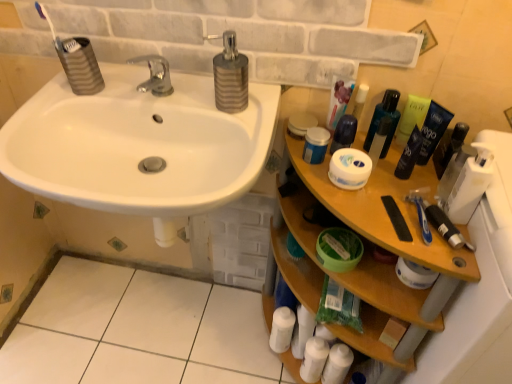
Question: From a real-world perspective, is green plastic bottle at upper right, the 5th mouthwash when ordered from left to right, beneath white tile at lower left?

Choices:
 (A) yes
 (B) no

Answer: (B)

Question: Is green plastic bottle at upper right, the 5th mouthwash when ordered from left to right, to the right of white tile at lower left from the viewer's perspective?

Choices:
 (A) no
 (B) yes

Answer: (B)

Question: Is green plastic bottle at upper right, the 3th mouthwash in the right-to-left sequence, in contact with white tile at lower left?

Choices:
 (A) no
 (B) yes

Answer: (A)

Question: Is green plastic bottle at upper right, the 3th mouthwash in the right-to-left sequence, positioned before white tile at lower left?

Choices:
 (A) yes
 (B) no

Answer: (A)

Question: Is green plastic bottle at upper right, the 3th mouthwash in the right-to-left sequence, smaller than white tile at lower left?

Choices:
 (A) yes
 (B) no

Answer: (A)

Question: Is silver metallic soap dispenser at upper center situated inside white matte tube at upper right or outside?

Choices:
 (A) inside
 (B) outside

Answer: (B)

Question: Considering the positions of silver metallic soap dispenser at upper center and white matte tube at upper right in the image, is silver metallic soap dispenser at upper center taller or shorter than white matte tube at upper right?

Choices:
 (A) short
 (B) tall

Answer: (B)

Question: Based on their sizes in the image, would you say silver metallic soap dispenser at upper center is bigger or smaller than white matte tube at upper right?

Choices:
 (A) big
 (B) small

Answer: (A)

Question: In the image, is silver metallic soap dispenser at upper center on the left side or the right side of white matte tube at upper right?

Choices:
 (A) right
 (B) left

Answer: (B)

Question: In the image, is green plastic bottle at upper right, the 3th mouthwash in the right-to-left sequence, on the left side or the right side of wooden shelf at right?

Choices:
 (A) right
 (B) left

Answer: (A)

Question: From a real-world perspective, is green plastic bottle at upper right, the 3th mouthwash in the right-to-left sequence, positioned above or below wooden shelf at right?

Choices:
 (A) above
 (B) below

Answer: (A)

Question: Considering the positions of green plastic bottle at upper right, the 5th mouthwash when ordered from left to right, and wooden shelf at right in the image, is green plastic bottle at upper right, the 5th mouthwash when ordered from left to right, bigger or smaller than wooden shelf at right?

Choices:
 (A) small
 (B) big

Answer: (A)

Question: From the image's perspective, is green plastic bottle at upper right, the 5th mouthwash when ordered from left to right, above or below wooden shelf at right?

Choices:
 (A) above
 (B) below

Answer: (A)

Question: Based on their positions, is transparent plastic bottle at upper right, which is the third mouthwash from left to right, located to the left or right of white tile at lower left?

Choices:
 (A) left
 (B) right

Answer: (B)

Question: From their relative heights in the image, would you say transparent plastic bottle at upper right, which is the third mouthwash from left to right, is taller or shorter than white tile at lower left?

Choices:
 (A) tall
 (B) short

Answer: (A)